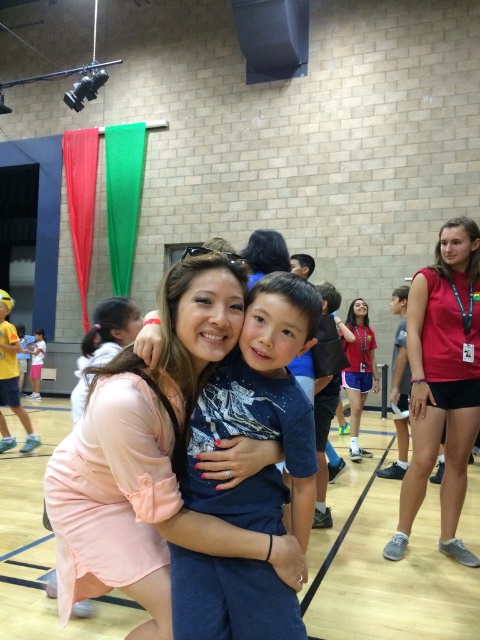
You are a photographer trying to capture the woman in the pink fabric dress at center and the light pink dress at center. Which dress should you focus on to ensure the woman is clearly visible in the photo?

The pink fabric dress at center is in front of the light pink dress at center, so focusing on the pink fabric dress at center will ensure the woman is clearly visible.